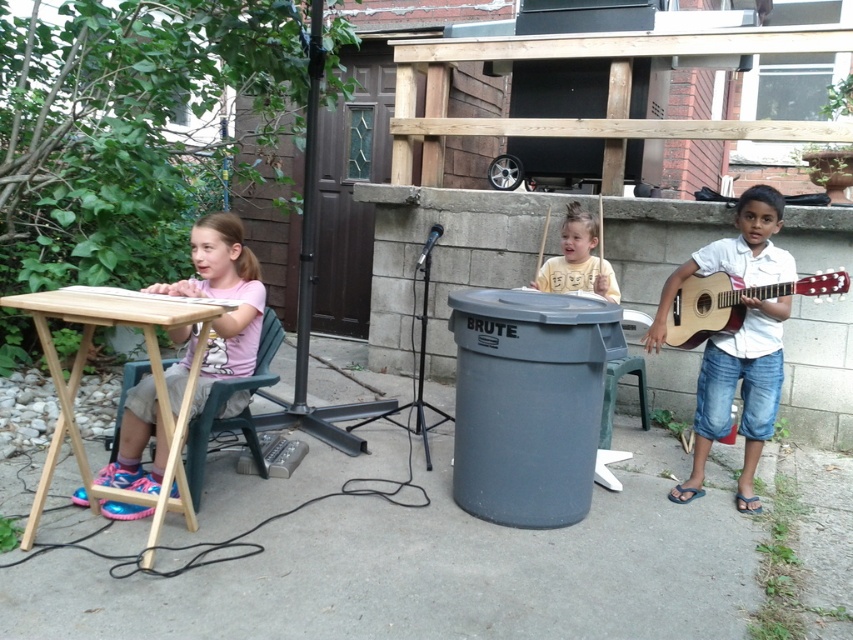
You are standing in the backyard and see the white matte shirt at right. Where exactly is it located in terms of coordinates?

The white matte shirt at right is located at coordinates point [740,394].

You are a photographer trying to capture a closeup of the acoustic wood guitar at right and the green plastic chair at left in the scene. Which object should you focus on first to ensure it appears sharp in your photo?

The acoustic wood guitar at right is closer to the viewer than the green plastic chair at left, so you should focus on the acoustic wood guitar at right first to ensure it appears sharp.

What object is located at the coordinates point (732, 301)?

The point (732, 301) is located on the acoustic wood guitar at right.